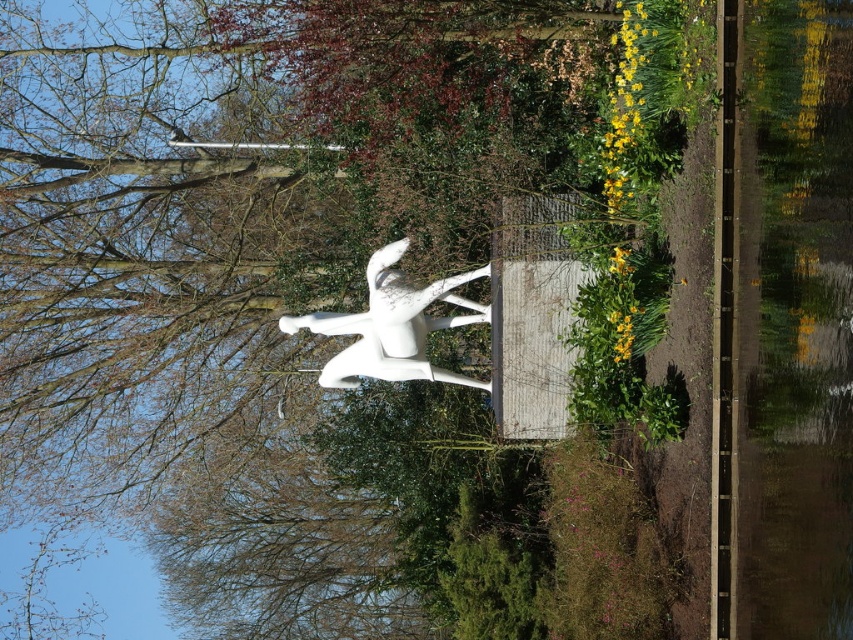
Between transparent glass water at right and white glossy bird at center, which one has less height?

white glossy bird at center is shorter.

From the picture: Is transparent glass water at right to the right of white glossy bird at center from the viewer's perspective?

Indeed, transparent glass water at right is positioned on the right side of white glossy bird at center.

Is point (740, 358) positioned in front of point (343, 330)?

Yes, point (740, 358) is in front of point (343, 330).

Where is `transparent glass water at right`? The image size is (853, 640). transparent glass water at right is located at coordinates (793, 321).